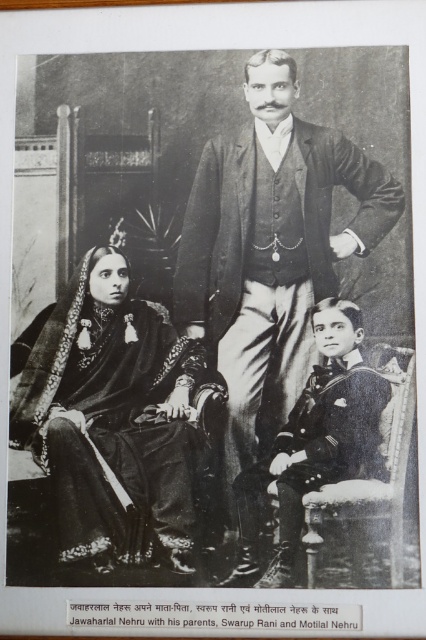
Looking at the portrait, can you tell me which object is positioned to the right of the other between the smooth black suit at center and the velvet black Shawl at center?

The smooth black suit at center is to the right of the velvet black shawl at center.

Looking at this image, you are a photographer analyzing this portrait. You notice the velvet black shawl at center and the sailor suit at lower right. Which object is closer to you in the image?

The velvet black shawl at center is closer to you than the sailor suit at lower right.